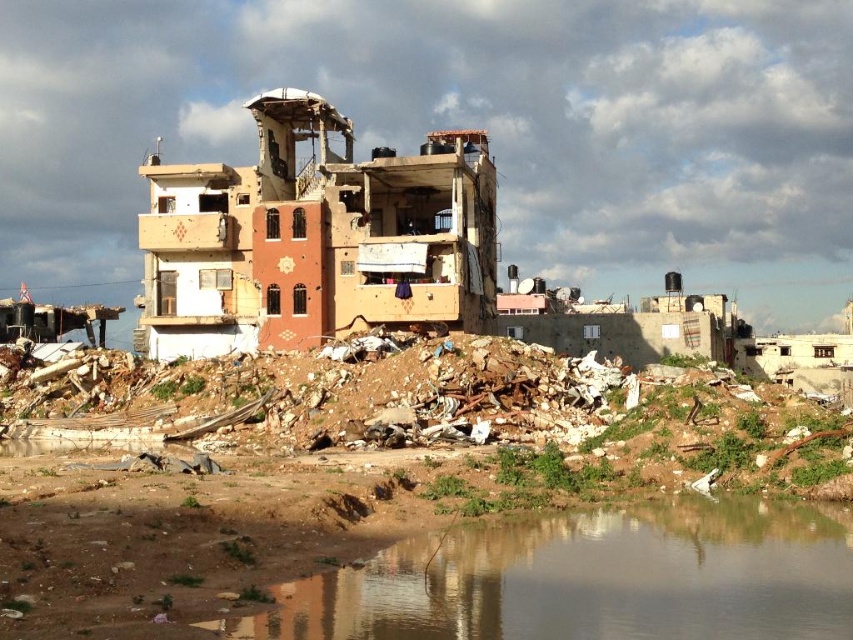
Question: Can you confirm if brown textured building at center is positioned to the right of brown dirt at lower center?

Choices:
 (A) no
 (B) yes

Answer: (A)

Question: In this image, where is brown textured building at center located relative to brown dirt at lower center?

Choices:
 (A) right
 (B) left

Answer: (B)

Question: Considering the relative positions of brown textured building at center and brown dirt at lower center in the image provided, where is brown textured building at center located with respect to brown dirt at lower center?

Choices:
 (A) left
 (B) right

Answer: (A)